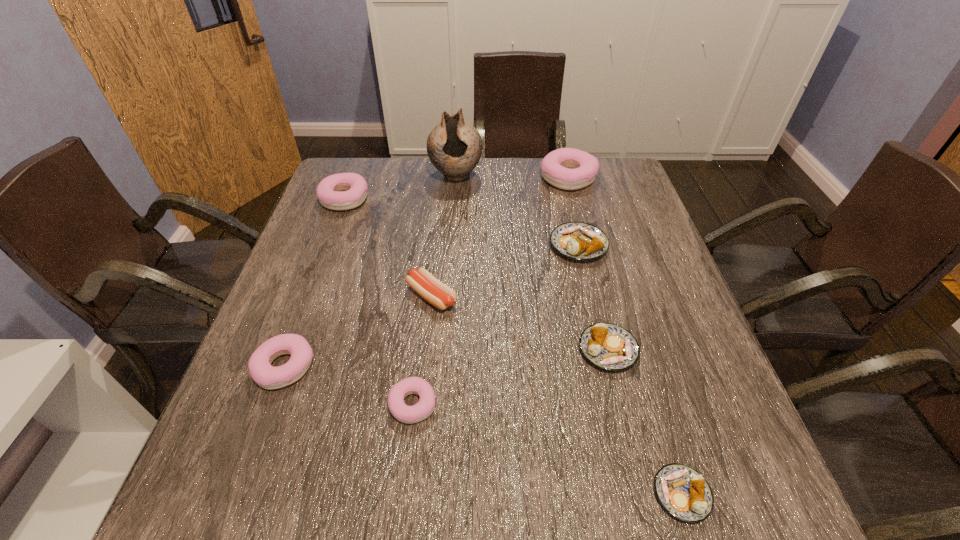
Find the location of a particular element. The image size is (960, 540). unoccupied area between the second biggest pink pastry and the second smallest pink pastry is located at coordinates (x=315, y=283).

You are a GUI agent. You are given a task and a screenshot of the screen. Output one action in this format:
    pyautogui.click(x=<x>, y=<y>)
    Task: Click on the unoccupied area between the third smallest pink pastry and the pottery
    
    Given the screenshot: What is the action you would take?
    pyautogui.click(x=400, y=187)

I want to click on vacant space that is in between the second biggest pink pastry and the second smallest pink pastry, so click(315, 283).

Point out which object is positioned as the fourth nearest to the rightmost pink pastry. Please provide its 2D coordinates. Your answer should be formatted as a tuple, i.e. [(x, y)], where the tuple contains the x and y coordinates of a point satisfying the conditions above.

[(608, 346)]

Locate an element on the screen. object that stands as the eighth closest to the second nearest brown pastry is located at coordinates (353, 187).

Choose which pastry is the nearest neighbor to the third biggest pink pastry. Please provide its 2D coordinates. Your answer should be formatted as a tuple, i.e. [(x, y)], where the tuple contains the x and y coordinates of a point satisfying the conditions above.

[(412, 385)]

Choose which pastry is the fourth nearest neighbor to the third pastry from left to right. Please provide its 2D coordinates. Your answer should be formatted as a tuple, i.e. [(x, y)], where the tuple contains the x and y coordinates of a point satisfying the conditions above.

[(581, 241)]

Identify which pink pastry is the second nearest to the second farthest brown pastry. Please provide its 2D coordinates. Your answer should be formatted as a tuple, i.e. [(x, y)], where the tuple contains the x and y coordinates of a point satisfying the conditions above.

[(566, 168)]

Locate which pink pastry ranks in proximity to the nearest pastry. Please provide its 2D coordinates. Your answer should be formatted as a tuple, i.e. [(x, y)], where the tuple contains the x and y coordinates of a point satisfying the conditions above.

[(412, 385)]

Where is `brown pastry identified as the closest to the nearest brown pastry`? This screenshot has width=960, height=540. brown pastry identified as the closest to the nearest brown pastry is located at coordinates point(608,346).